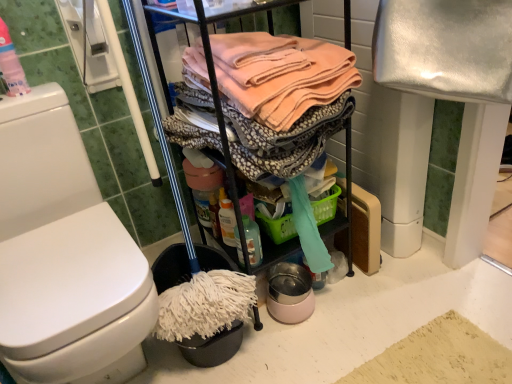
Question: Are translucent plastic bottle at upper left, the first cleaning products from the left, and white glossy toilet at left making contact?

Choices:
 (A) no
 (B) yes

Answer: (A)

Question: From a real-world perspective, is translucent plastic bottle at upper left, which appears as the second cleaning products when viewed from the right, located beneath white glossy toilet at left?

Choices:
 (A) no
 (B) yes

Answer: (A)

Question: Considering the relative sizes of translucent plastic bottle at upper left, which is the 2th cleaning products in bottom-to-top order, and white glossy toilet at left in the image provided, is translucent plastic bottle at upper left, which is the 2th cleaning products in bottom-to-top order, taller than white glossy toilet at left?

Choices:
 (A) no
 (B) yes

Answer: (A)

Question: Is translucent plastic bottle at upper left, the 1th cleaning products positioned from the top, oriented towards white glossy toilet at left?

Choices:
 (A) yes
 (B) no

Answer: (B)

Question: From the image's perspective, would you say translucent plastic bottle at upper left, which appears as the second cleaning products when viewed from the right, is shown under white glossy toilet at left?

Choices:
 (A) no
 (B) yes

Answer: (A)

Question: From the image's perspective, relative to translucent plastic bottle at upper left, the 1th cleaning products positioned from the top, is white glossy toilet at left above or below?

Choices:
 (A) above
 (B) below

Answer: (B)

Question: In the image, is white glossy toilet at left positioned in front of or behind translucent plastic bottle at upper left, the 1th cleaning products positioned from the top?

Choices:
 (A) behind
 (B) front

Answer: (B)

Question: Choose the correct answer: Is white glossy toilet at left inside translucent plastic bottle at upper left, which appears as the 2th cleaning products when viewed from the back, or outside it?

Choices:
 (A) outside
 (B) inside

Answer: (A)

Question: Looking at their shapes, would you say white glossy toilet at left is wider or thinner than translucent plastic bottle at upper left, the 1th cleaning products in the front-to-back sequence?

Choices:
 (A) wide
 (B) thin

Answer: (A)

Question: Is white glossy toilet at left to the left or to the right of translucent plastic spray bottle at lower center, the 1th cleaning products from the right, in the image?

Choices:
 (A) right
 (B) left

Answer: (B)

Question: From the image's perspective, is white glossy toilet at left located above or below translucent plastic spray bottle at lower center, the 1th cleaning products from the right?

Choices:
 (A) above
 (B) below

Answer: (B)

Question: Is white glossy toilet at left bigger or smaller than translucent plastic spray bottle at lower center, which appears as the 2th cleaning products when viewed from the top?

Choices:
 (A) small
 (B) big

Answer: (B)

Question: In the image, is white glossy toilet at left positioned in front of or behind translucent plastic spray bottle at lower center, which ranks as the second cleaning products in front-to-back order?

Choices:
 (A) front
 (B) behind

Answer: (A)

Question: From the image's perspective, relative to soft peach fabric at center, is translucent plastic spray bottle at lower center, which appears as the 2th cleaning products when viewed from the top, above or below?

Choices:
 (A) above
 (B) below

Answer: (B)

Question: From their relative heights in the image, would you say translucent plastic spray bottle at lower center, which ranks as the second cleaning products in front-to-back order, is taller or shorter than soft peach fabric at center?

Choices:
 (A) tall
 (B) short

Answer: (B)